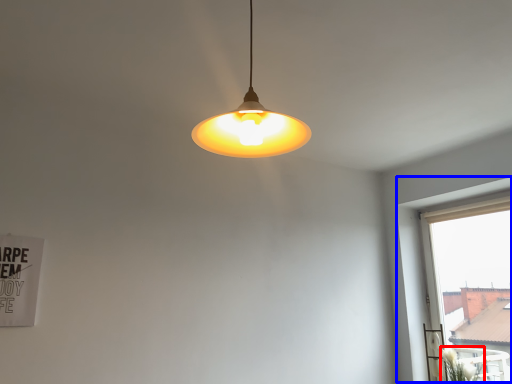
Question: Which object appears closest to the camera in this image, plant (highlighted by a red box) or window (highlighted by a blue box)?

Choices:
 (A) plant
 (B) window

Answer: (B)